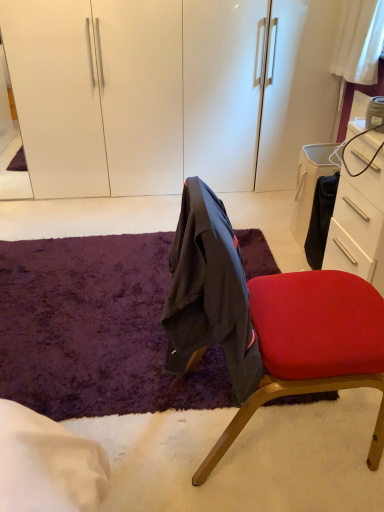
Question: Is white glossy drawer at right further to camera compared to purple shaggy rug at center?

Choices:
 (A) yes
 (B) no

Answer: (B)

Question: Are white glossy drawer at right and purple shaggy rug at center located far from each other?

Choices:
 (A) yes
 (B) no

Answer: (B)

Question: Is white glossy drawer at right thinner than purple shaggy rug at center?

Choices:
 (A) yes
 (B) no

Answer: (A)

Question: Can you confirm if white glossy drawer at right is shorter than purple shaggy rug at center?

Choices:
 (A) no
 (B) yes

Answer: (A)

Question: From a real-world perspective, is white glossy drawer at right on top of purple shaggy rug at center?

Choices:
 (A) yes
 (B) no

Answer: (A)

Question: From a real-world perspective, is velvet red chair at center positioned above or below white glossy drawer at right?

Choices:
 (A) above
 (B) below

Answer: (A)

Question: In the image, is velvet red chair at center positioned in front of or behind white glossy drawer at right?

Choices:
 (A) front
 (B) behind

Answer: (A)

Question: In terms of width, does velvet red chair at center look wider or thinner when compared to white glossy drawer at right?

Choices:
 (A) thin
 (B) wide

Answer: (B)

Question: Is velvet red chair at center spatially inside white glossy drawer at right, or outside of it?

Choices:
 (A) outside
 (B) inside

Answer: (A)

Question: Is purple shaggy rug at center inside the boundaries of velvet red chair at center, or outside?

Choices:
 (A) inside
 (B) outside

Answer: (B)

Question: Looking at their shapes, would you say purple shaggy rug at center is wider or thinner than velvet red chair at center?

Choices:
 (A) wide
 (B) thin

Answer: (A)

Question: From their relative heights in the image, would you say purple shaggy rug at center is taller or shorter than velvet red chair at center?

Choices:
 (A) tall
 (B) short

Answer: (B)

Question: From the image's perspective, relative to velvet red chair at center, is purple shaggy rug at center above or below?

Choices:
 (A) above
 (B) below

Answer: (B)

Question: Is white glossy drawer at right inside the boundaries of purple shaggy rug at center, or outside?

Choices:
 (A) inside
 (B) outside

Answer: (B)

Question: Considering the positions of white glossy drawer at right and purple shaggy rug at center in the image, is white glossy drawer at right wider or thinner than purple shaggy rug at center?

Choices:
 (A) thin
 (B) wide

Answer: (A)